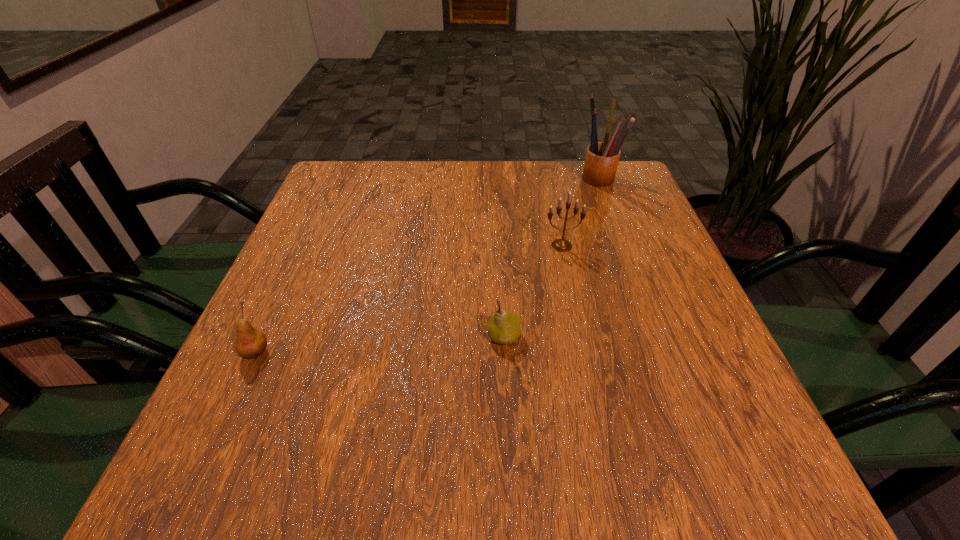
This screenshot has width=960, height=540. I want to click on empty space that is in between the third object from right to left and the leftmost object, so click(x=380, y=345).

At what (x,y) coordinates should I click in order to perform the action: click on object that is the second closest one to the left pear. Please return your answer as a coordinate pair (x, y). This screenshot has width=960, height=540. Looking at the image, I should click on (561, 245).

Locate an element on the screen. The image size is (960, 540). object that is the second closest to the second object from right to left is located at coordinates (504, 327).

Where is `vacant space that satisfies the following two spatial constraints: 1. on the back side of the third object from right to left; 2. on the left side of the farthest object`? This screenshot has width=960, height=540. vacant space that satisfies the following two spatial constraints: 1. on the back side of the third object from right to left; 2. on the left side of the farthest object is located at coordinates (496, 179).